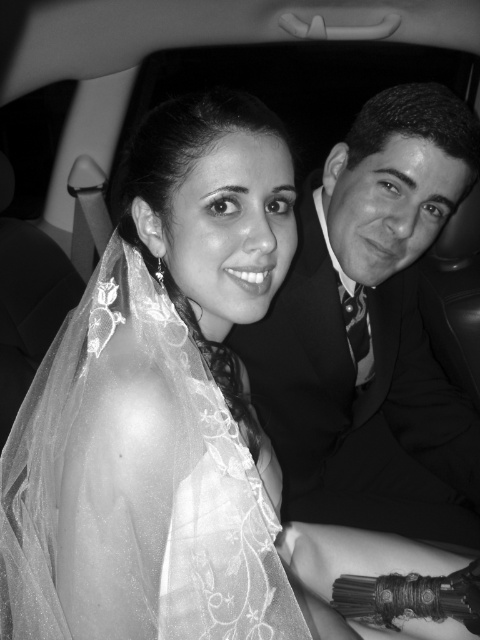
You are a photographer who needs to adjust the lighting for the translucent lace veil at upper left and the smooth black suit at right. Since the veil is delicate, you want to ensure it doesn not cast a harsh shadow on the suit. Based on their positions, which object is closer to the left side of the frame?

The translucent lace veil at upper left is closer to the left side of the frame than the smooth black suit at right, so adjusting the lighting here would help prevent harsh shadows on the suit.